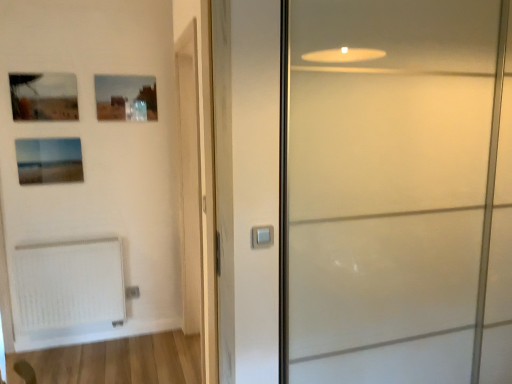
Question: Does satin silver switch at center have a larger size compared to matte glass picture frame at upper left, the second picture frame in the top-to-bottom sequence?

Choices:
 (A) yes
 (B) no

Answer: (B)

Question: From a real-world perspective, is satin silver switch at center positioned under matte glass picture frame at upper left, the second picture frame in the top-to-bottom sequence, based on gravity?

Choices:
 (A) yes
 (B) no

Answer: (A)

Question: From the image's perspective, is satin silver switch at center located above matte glass picture frame at upper left, the second picture frame in the top-to-bottom sequence?

Choices:
 (A) yes
 (B) no

Answer: (B)

Question: Does satin silver switch at center have a lesser width compared to matte glass picture frame at upper left, the second picture frame in the top-to-bottom sequence?

Choices:
 (A) no
 (B) yes

Answer: (B)

Question: Is satin silver switch at center positioned behind matte glass picture frame at upper left, the second picture frame from the bottom?

Choices:
 (A) yes
 (B) no

Answer: (B)

Question: Does point (25, 145) appear closer or farther from the camera than point (114, 79)?

Choices:
 (A) farther
 (B) closer

Answer: (B)

Question: Based on their positions, is matte glass picture frame at upper left, which appears as the 1th picture frame when ordered from the bottom, located to the left or right of matte glass picture frame at upper center, acting as the 1th picture frame starting from the top?

Choices:
 (A) left
 (B) right

Answer: (A)

Question: Considering the positions of matte glass picture frame at upper left, arranged as the 3th picture frame when viewed from the top, and matte glass picture frame at upper center, acting as the 1th picture frame starting from the top, in the image, is matte glass picture frame at upper left, arranged as the 3th picture frame when viewed from the top, wider or thinner than matte glass picture frame at upper center, acting as the 1th picture frame starting from the top,?

Choices:
 (A) thin
 (B) wide

Answer: (A)

Question: From a real-world perspective, relative to matte glass picture frame at upper center, acting as the 1th picture frame starting from the top, is matte glass picture frame at upper left, arranged as the 3th picture frame when viewed from the top, vertically above or below?

Choices:
 (A) above
 (B) below

Answer: (B)

Question: Looking at their shapes, would you say matte glass picture frame at upper center, which is the third picture frame from bottom to top, is wider or thinner than wooden barn door at center?

Choices:
 (A) wide
 (B) thin

Answer: (B)

Question: Considering the positions of point (148, 76) and point (197, 177), is point (148, 76) closer or farther from the camera than point (197, 177)?

Choices:
 (A) farther
 (B) closer

Answer: (A)

Question: Is matte glass picture frame at upper center, which is the third picture frame from bottom to top, taller or shorter than wooden barn door at center?

Choices:
 (A) short
 (B) tall

Answer: (A)

Question: Visually, is matte glass picture frame at upper center, which is the third picture frame from bottom to top, positioned to the left or to the right of wooden barn door at center?

Choices:
 (A) right
 (B) left

Answer: (B)

Question: Looking at the image, does wooden barn door at center seem bigger or smaller compared to satin silver switch at center?

Choices:
 (A) big
 (B) small

Answer: (A)

Question: Is wooden barn door at center situated inside satin silver switch at center or outside?

Choices:
 (A) outside
 (B) inside

Answer: (A)